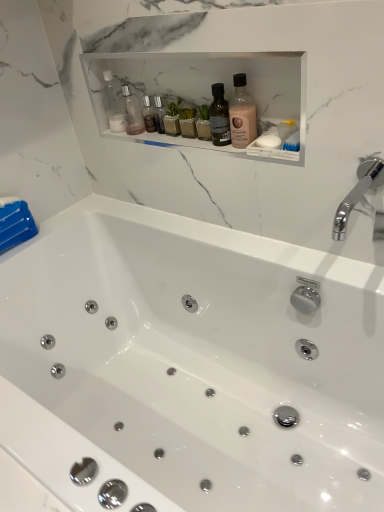
Question: Can you see white matte soap at right touching chrome metallic faucet at upper right?

Choices:
 (A) yes
 (B) no

Answer: (B)

Question: Is white matte soap at right thinner than chrome metallic faucet at upper right?

Choices:
 (A) no
 (B) yes

Answer: (B)

Question: Can we say white matte soap at right lies outside chrome metallic faucet at upper right?

Choices:
 (A) no
 (B) yes

Answer: (B)

Question: From the image's perspective, is white matte soap at right under chrome metallic faucet at upper right?

Choices:
 (A) yes
 (B) no

Answer: (B)

Question: Does white matte soap at right have a greater height compared to chrome metallic faucet at upper right?

Choices:
 (A) yes
 (B) no

Answer: (B)

Question: Does white matte soap at right appear on the right side of chrome metallic faucet at upper right?

Choices:
 (A) no
 (B) yes

Answer: (A)

Question: Is transparent plastic bottle at upper center, which ranks as the second bottle in back-to-front order, to the left of pink matte bottle at center, which is the third bottle in back-to-front order, from the viewer's perspective?

Choices:
 (A) no
 (B) yes

Answer: (B)

Question: Is transparent plastic bottle at upper center, acting as the first bottle starting from the left, next to pink matte bottle at center, arranged as the 3th bottle when viewed from the left?

Choices:
 (A) yes
 (B) no

Answer: (B)

Question: From the image's perspective, would you say transparent plastic bottle at upper center, acting as the second bottle starting from the front, is positioned over pink matte bottle at center, which is the third bottle in back-to-front order?

Choices:
 (A) no
 (B) yes

Answer: (B)

Question: Could you tell me if transparent plastic bottle at upper center, acting as the second bottle starting from the front, is turned towards pink matte bottle at center, arranged as the 3th bottle when viewed from the left?

Choices:
 (A) no
 (B) yes

Answer: (A)

Question: From the image's perspective, is transparent plastic bottle at upper center, which ranks as the 3th bottle in right-to-left order, located beneath pink matte bottle at center, arranged as the 3th bottle when viewed from the left?

Choices:
 (A) no
 (B) yes

Answer: (A)

Question: Is transparent plastic bottle at upper center, which ranks as the 3th bottle in right-to-left order, positioned behind pink matte bottle at center, which is the third bottle in back-to-front order?

Choices:
 (A) no
 (B) yes

Answer: (B)

Question: From the image's perspective, does white glossy bathtub at center appear lower than transparent plastic bottle at upper center, the 2th bottle positioned from the right?

Choices:
 (A) yes
 (B) no

Answer: (A)